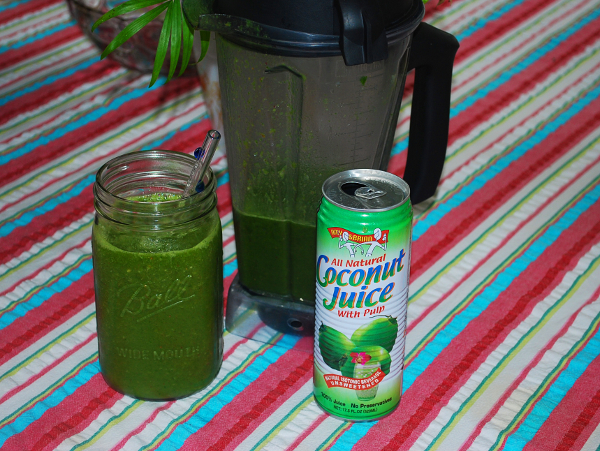
You are a GUI agent. You are given a task and a screenshot of the screen. Output one action in this format:
    pyautogui.click(x=<x>, y=<y>)
    Task: Click on the bowl
    The height and width of the screenshot is (451, 600).
    Given the screenshot: What is the action you would take?
    pyautogui.click(x=95, y=32)